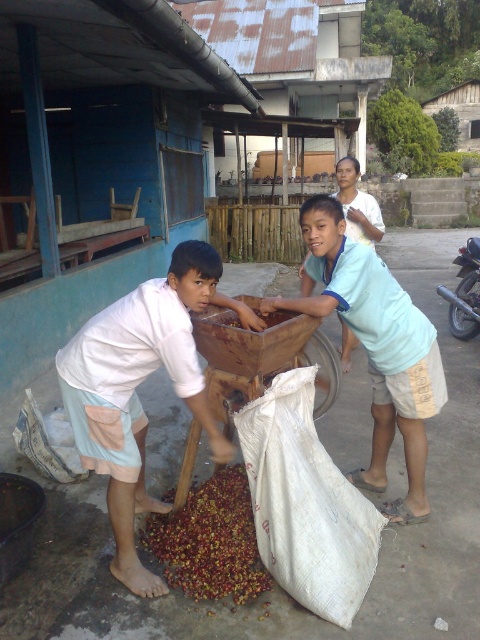
Measure the distance between point (314, 257) and camera.

They are 2.92 meters apart.

Who is lower down, light blue cotton shirt at center or brown matte food at center?

light blue cotton shirt at center is lower down.

Which is behind, point (374, 410) or point (274, 320)?

Positioned behind is point (374, 410).

Image resolution: width=480 pixels, height=640 pixels. What are the coordinates of `light blue cotton shirt at center` in the screenshot? It's located at (374, 346).

Between red matte coffee beans at lower center and light blue fabric shirt at center, which one appears on the left side from the viewer's perspective?

red matte coffee beans at lower center is more to the left.

Is red matte coffee beans at lower center to the right of light blue fabric shirt at center from the viewer's perspective?

In fact, red matte coffee beans at lower center is to the left of light blue fabric shirt at center.

The width and height of the screenshot is (480, 640). I want to click on red matte coffee beans at lower center, so click(211, 540).

Is white cotton shirt at left wider than red matte coffee beans at lower center?

Yes.

Is point (132, 483) farther from camera compared to point (228, 490)?

No, (132, 483) is closer to viewer.

At what (x,y) coordinates should I click in order to perform the action: click on white cotton shirt at left. Please return your answer as a coordinate pair (x, y). The width and height of the screenshot is (480, 640). Looking at the image, I should click on (136, 385).